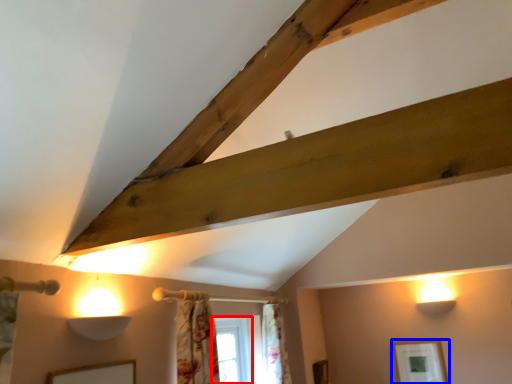
Question: Among these objects, which one is farthest to the camera, window (highlighted by a red box) or picture frame (highlighted by a blue box)?

Choices:
 (A) window
 (B) picture frame

Answer: (B)